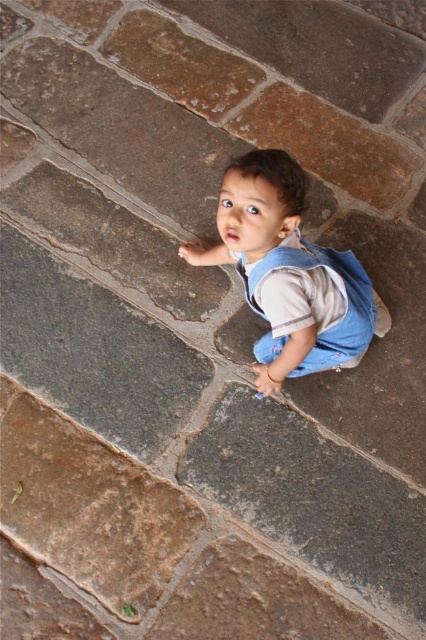
Question: Among these objects, which one is nearest to the camera?

Choices:
 (A) blue denim vest at center
 (B) blue denim overalls at center

Answer: (B)

Question: Where is blue denim overalls at center located in relation to blue denim vest at center in the image?

Choices:
 (A) right
 (B) left

Answer: (B)

Question: From the image, what is the correct spatial relationship of blue denim overalls at center in relation to blue denim vest at center?

Choices:
 (A) right
 (B) left

Answer: (B)

Question: Among these points, which one is nearest to the camera?

Choices:
 (A) (319, 360)
 (B) (325, 344)

Answer: (B)

Question: Can you confirm if blue denim overalls at center is positioned to the right of blue denim vest at center?

Choices:
 (A) no
 (B) yes

Answer: (A)